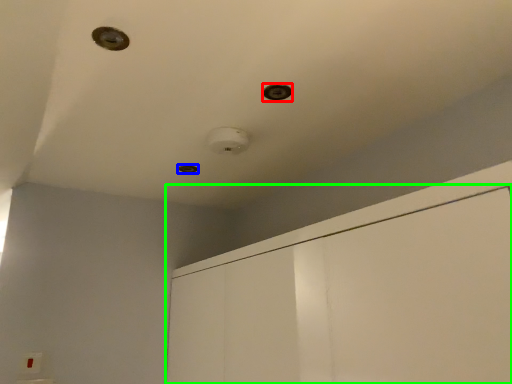
Question: Considering the real-world distances, which object is closest to hole (highlighted by a red box)? hole (highlighted by a blue box) or dresser (highlighted by a green box).

Choices:
 (A) hole
 (B) dresser

Answer: (B)